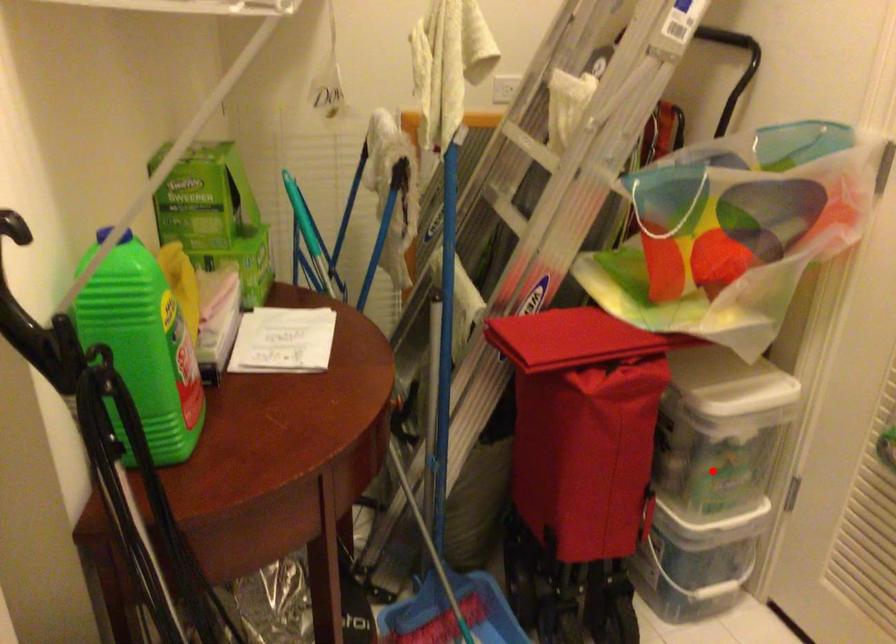
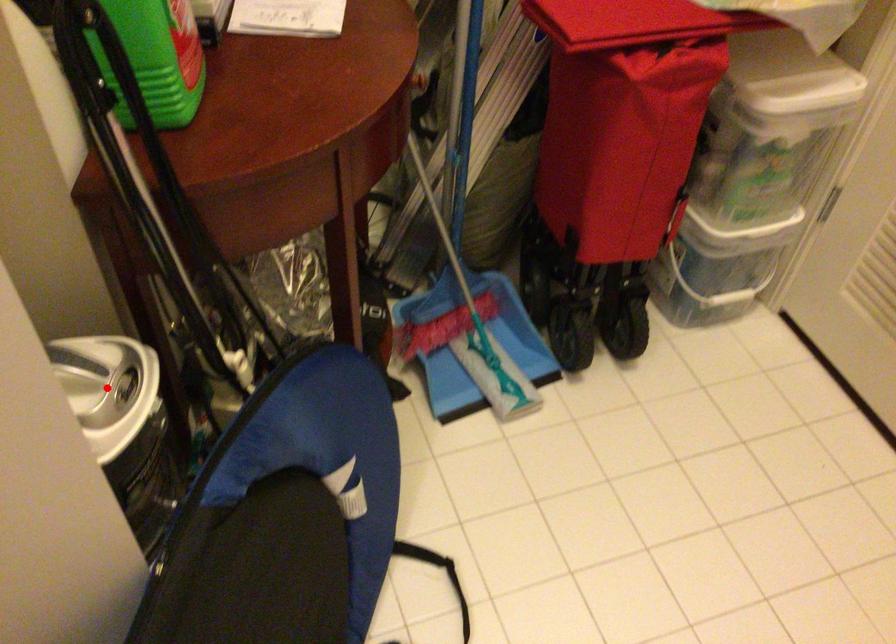
I am providing you with two images of the same scene from different viewpoints. A red point is marked on the first image and another point is marked on the second image. Are the points marked in image1 and image2 representing the same 3D position?

No